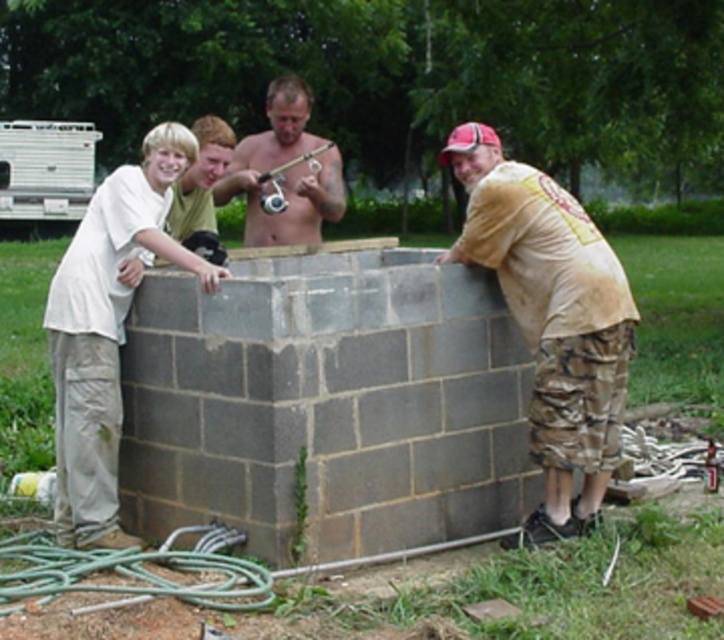
You are standing at the point labeled as point (568, 481) and want to move towards the construction site. The construction site is 19.20 feet away from you. If you walk straight ahead, will you reach the construction site before walking 20 feet?

Yes, because the distance from the viewer to point (568, 481) is 19.20 feet, which is less than 20 feet, so walking straight ahead will reach the construction site before walking 20 feet.